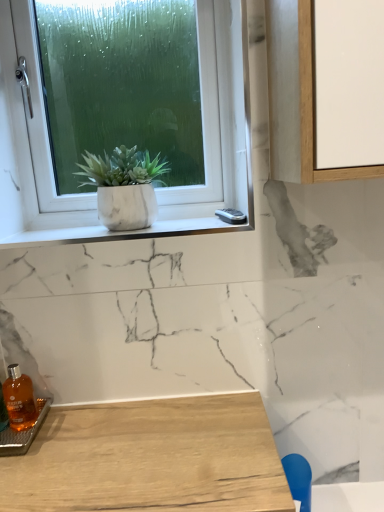
Question: From a real-world perspective, is blue plastic chair at lower right above or below white marble window sill at upper left?

Choices:
 (A) above
 (B) below

Answer: (B)

Question: Choose the correct answer: Is blue plastic chair at lower right inside white marble window sill at upper left or outside it?

Choices:
 (A) inside
 (B) outside

Answer: (B)

Question: Which of these objects is positioned closest to the translucent amber glass bottle at lower left?

Choices:
 (A) blue plastic chair at lower right
 (B) white marble window sill at upper left
 (C) white matte window at upper left
 (D) white marble pot at upper left

Answer: (B)

Question: Which object is the farthest from the white marble window sill at upper left?

Choices:
 (A) white matte window at upper left
 (B) translucent amber glass bottle at lower left
 (C) white marble pot at upper left
 (D) blue plastic chair at lower right

Answer: (D)